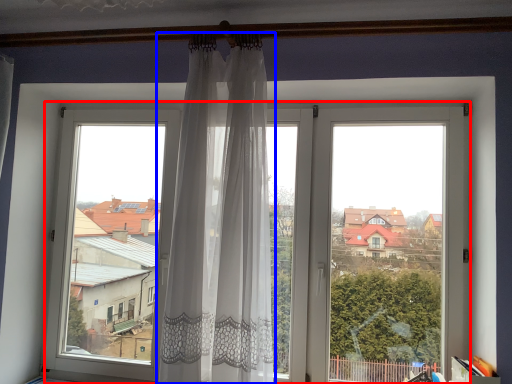
Question: Which of the following is the farthest to the observer, window (highlighted by a red box) or curtain (highlighted by a blue box)?

Choices:
 (A) window
 (B) curtain

Answer: (A)